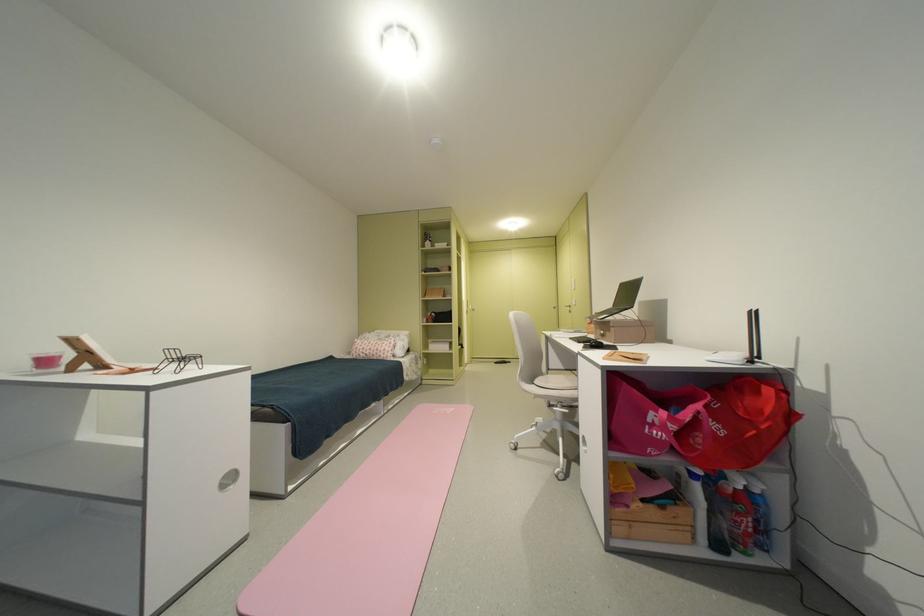
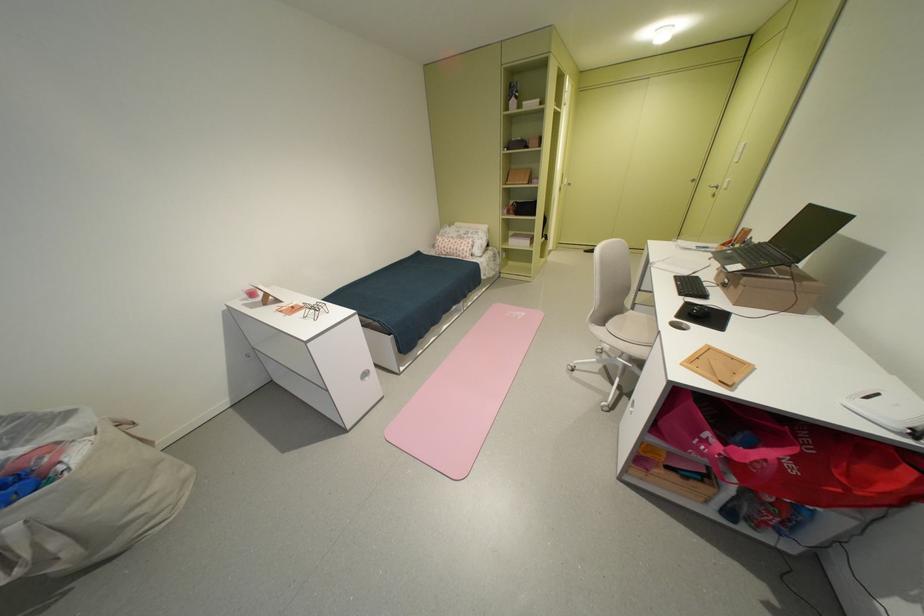
In the second image, find the point that corresponds to point (390, 352) in the first image.

(468, 252)